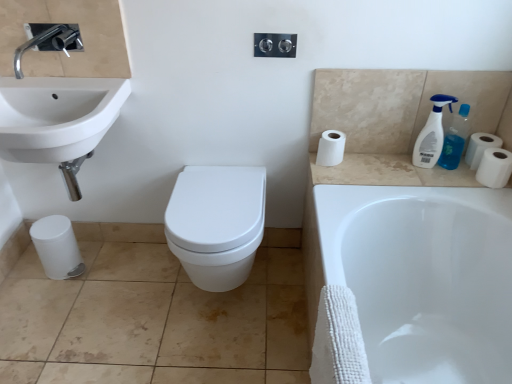
Locate an element on the screen. Image resolution: width=512 pixels, height=384 pixels. free region under white marble countertop at upper right (from a real-world perspective) is located at coordinates (392, 172).